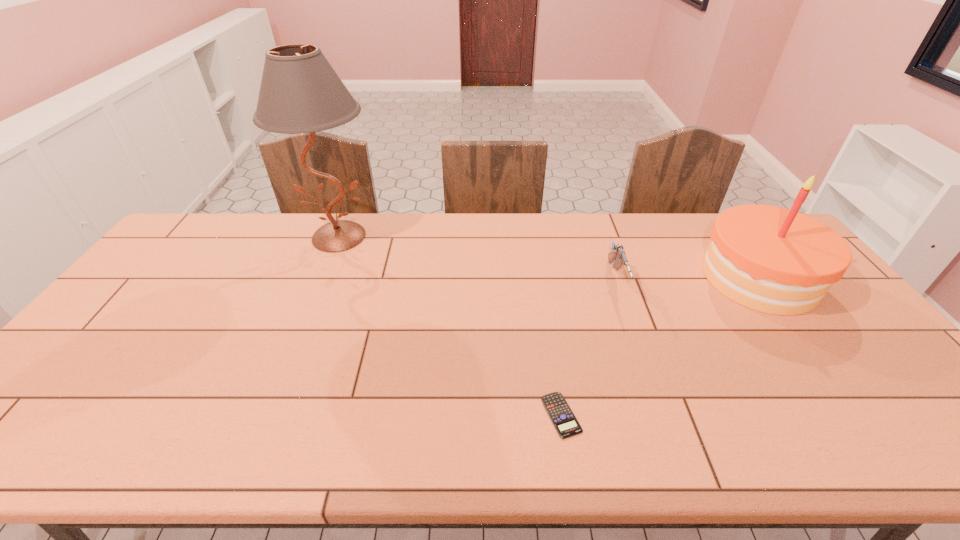
At what (x,y) coordinates should I click in order to perform the action: click on vacant space at the right edge. Please return your answer as a coordinate pair (x, y). The width and height of the screenshot is (960, 540). Looking at the image, I should click on (850, 323).

In order to click on vacant area at the far left corner of the desktop in this screenshot , I will do `click(233, 217)`.

Find the location of a particular element. The image size is (960, 540). vacant point located between the birthday cake and the third object from left to right is located at coordinates (687, 279).

Where is `vacant point located between the gun and the second tallest object`? vacant point located between the gun and the second tallest object is located at coordinates (687, 279).

The image size is (960, 540). I want to click on free area in between the third object from right to left and the rightmost object, so click(x=660, y=346).

Locate an element on the screen. This screenshot has width=960, height=540. vacant space in between the third object from left to right and the shortest object is located at coordinates (588, 348).

Locate an element on the screen. This screenshot has height=540, width=960. vacant area that lies between the calculator and the leftmost object is located at coordinates (450, 326).

Find the location of a particular element. The width and height of the screenshot is (960, 540). free area in between the leftmost object and the third object from left to right is located at coordinates (477, 259).

The width and height of the screenshot is (960, 540). I want to click on vacant space that is in between the tallest object and the calculator, so click(x=450, y=326).

Image resolution: width=960 pixels, height=540 pixels. I want to click on free space that is in between the birthday cake and the table lamp, so click(549, 257).